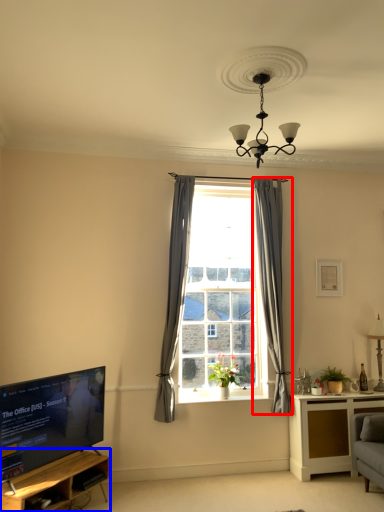
Question: Which point is closer to the camera, curtain (highlighted by a red box) or shelf (highlighted by a blue box)?

Choices:
 (A) curtain
 (B) shelf

Answer: (B)